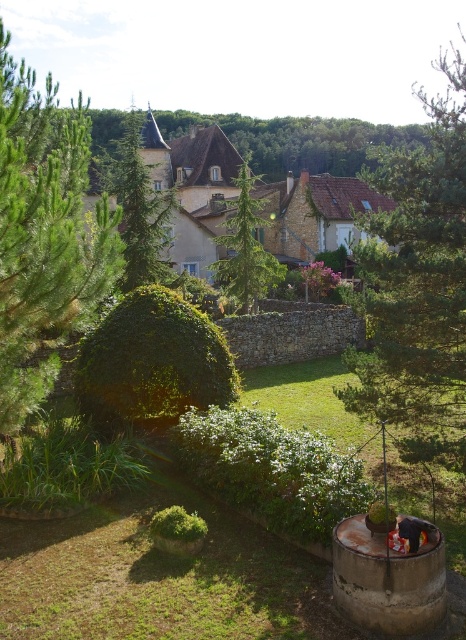
Is green leafy tree at center to the right of green needle-like tree at left from the viewer's perspective?

Indeed, green leafy tree at center is positioned on the right side of green needle-like tree at left.

Which is more to the left, green leafy tree at center or green needle-like tree at left?

From the viewer's perspective, green needle-like tree at left appears more on the left side.

Between point (413, 419) and point (89, 305), which one is positioned behind?

The point (413, 419) is more distant.

This screenshot has height=640, width=466. Identify the location of green leafy tree at center. 418,284.

Who is positioned more to the left, green needle-like tree at left or green textured tree at center?

Positioned to the left is green needle-like tree at left.

Which is behind, point (33, 256) or point (238, 264)?

The point (238, 264) is more distant.

In order to click on green needle-like tree at left in this screenshot , I will do click(45, 234).

Locate an element on the screen. This screenshot has width=466, height=640. green needle-like tree at left is located at coordinates (45, 234).

How distant is green needle-like tree at left from green textured pine tree at upper center?

24.41 meters

Who is more distant from viewer, (117, 273) or (124, 166)?

The point (124, 166) is more distant.

What are the coordinates of `green needle-like tree at left` in the screenshot? It's located at (45, 234).